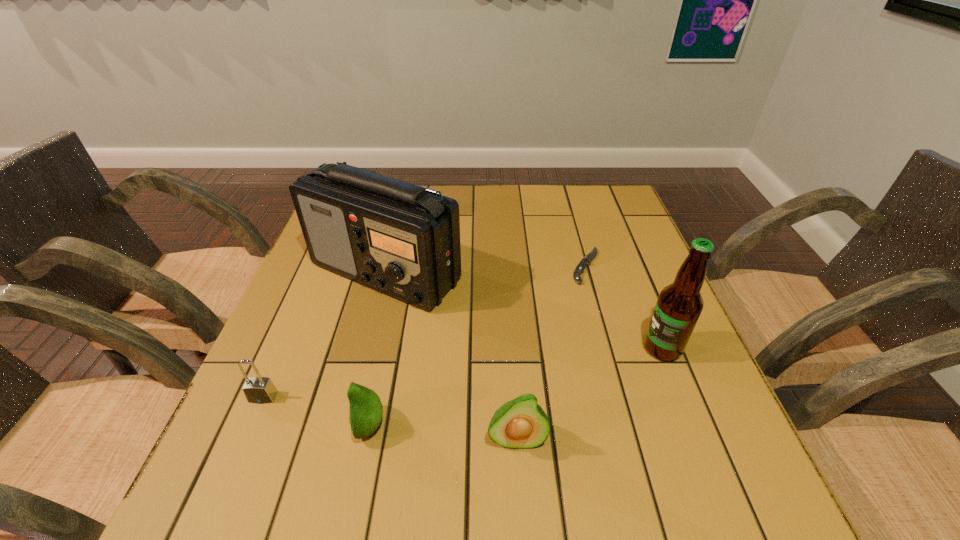
Locate an element on the screen. This screenshot has height=540, width=960. blank space located on the cut side of the left avocado is located at coordinates (277, 426).

Where is `free space located on the cut side of the left avocado`? free space located on the cut side of the left avocado is located at coordinates (266, 426).

At what (x,y) coordinates should I click in order to perform the action: click on vacant region located 0.310m on the label of the beer bottle. Please return your answer as a coordinate pair (x, y). Looking at the image, I should click on (495, 348).

This screenshot has height=540, width=960. In order to click on free location located on the label of the beer bottle in this screenshot , I will do `click(581, 348)`.

Identify the location of vacant area located on the label of the beer bottle. The height and width of the screenshot is (540, 960). (500, 348).

The height and width of the screenshot is (540, 960). Find the location of `vacant space situated on the front panel of the radio receiver`. vacant space situated on the front panel of the radio receiver is located at coordinates (345, 438).

Locate an element on the screen. free space located on the back of the shortest object is located at coordinates (576, 231).

Identify the location of vacant point located on the shackle of the padlock. (248, 434).

Where is `radio receiver present at the left edge`? The image size is (960, 540). radio receiver present at the left edge is located at coordinates (401, 239).

Identify the location of padlock that is at the left edge. (260, 390).